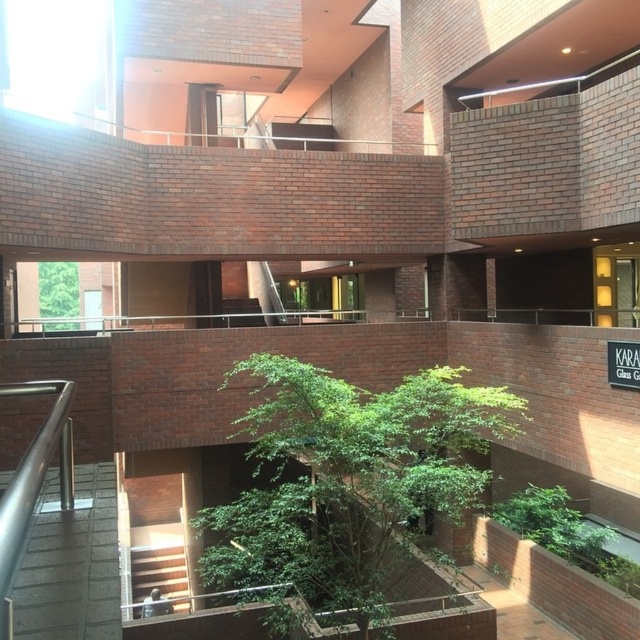
Which is more to the right, green leafy tree at center or green leafy tree at upper left?

green leafy tree at center is more to the right.

Looking at this image, can you confirm if green leafy tree at center is thinner than green leafy tree at upper left?

Indeed, green leafy tree at center has a lesser width compared to green leafy tree at upper left.

Is point (484, 442) positioned after point (65, 284)?

No, (484, 442) is closer to viewer.

Identify the location of green leafy tree at center. Image resolution: width=640 pixels, height=640 pixels. (348, 477).

Is point (228, 573) farther from viewer compared to point (161, 572)?

No, (228, 573) is closer to viewer.

Measure the distance between green leafy tree at center and camera.

4.41 meters

Locate an element on the screen. green leafy tree at center is located at coordinates (348, 477).

Is wooden staircase at lower left positioned behind green leafy tree at upper left?

Yes, it is.

Is point (138, 596) less distant than point (76, 284)?

Yes, point (138, 596) is closer to viewer.

I want to click on wooden staircase at lower left, so click(x=157, y=572).